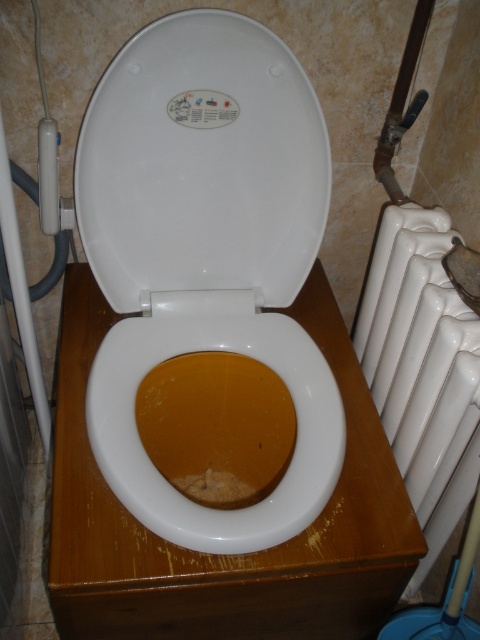
Does white glossy toilet seat at center have a greater height compared to brown matte toilet bowl at center?

Yes.

Which is in front, point (123, 188) or point (313, 483)?

Point (313, 483) is in front.

In order to click on white glossy toilet seat at center in this screenshot , I will do `click(202, 164)`.

Is white glossy toilet seat at center positioned in front of white glossy radiator at right?

No, white glossy toilet seat at center is further to the viewer.

Is white glossy toilet seat at center thinner than white glossy radiator at right?

In fact, white glossy toilet seat at center might be wider than white glossy radiator at right.

Image resolution: width=480 pixels, height=640 pixels. Describe the element at coordinates (202, 164) in the screenshot. I see `white glossy toilet seat at center` at that location.

In order to click on white glossy toilet seat at center in this screenshot , I will do `click(202, 164)`.

Who is positioned more to the right, brown matte toilet bowl at center or white glossy radiator at right?

white glossy radiator at right is more to the right.

Who is shorter, brown matte toilet bowl at center or white glossy radiator at right?

With less height is brown matte toilet bowl at center.

This screenshot has width=480, height=640. Identify the location of brown matte toilet bowl at center. (159, 474).